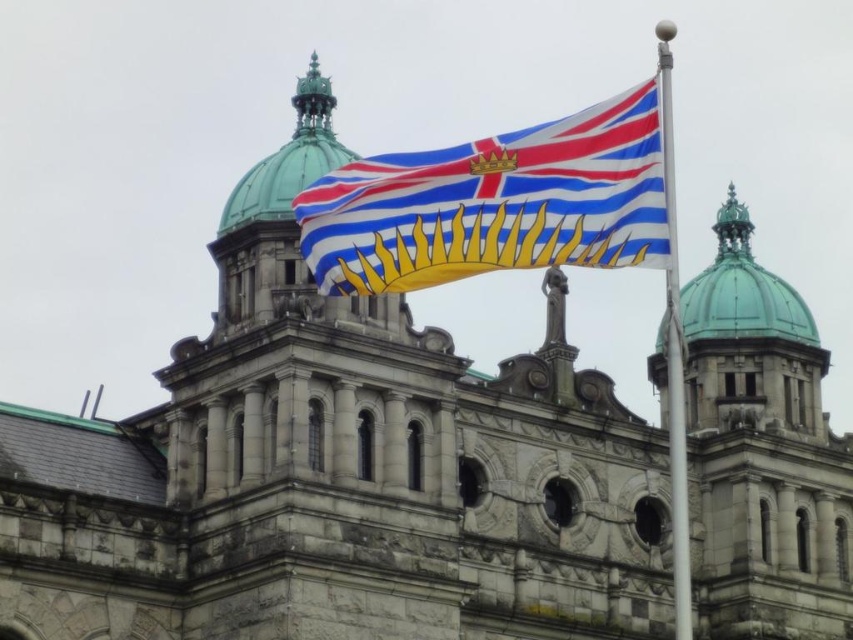
From the picture: You are a photographer planning to take a picture of the historic stone building. You notice the polyester flag at center and the polished silver pole at upper right in your frame. Which object will appear closer to the camera in your photo?

The polyester flag at center will appear closer to the camera because the polished silver pole at upper right is behind it.

You are standing in front of the historic stone building and want to determine the relative positions of two points marked on the facade. Which point, point (596, 189) or point (668, 211), is closer to you?

Point (596, 189) is closer to you because it is further to the viewer than point (668, 211).

From the picture: You are a photographer planning to capture the historic stone building with its flagpole. You notice the polyester flag at center and the polished silver pole at upper right. Which object would appear larger in your photo if you frame the scene to include both?

The polished silver pole at upper right would appear larger in the photo since it is larger than the polyester flag at center.